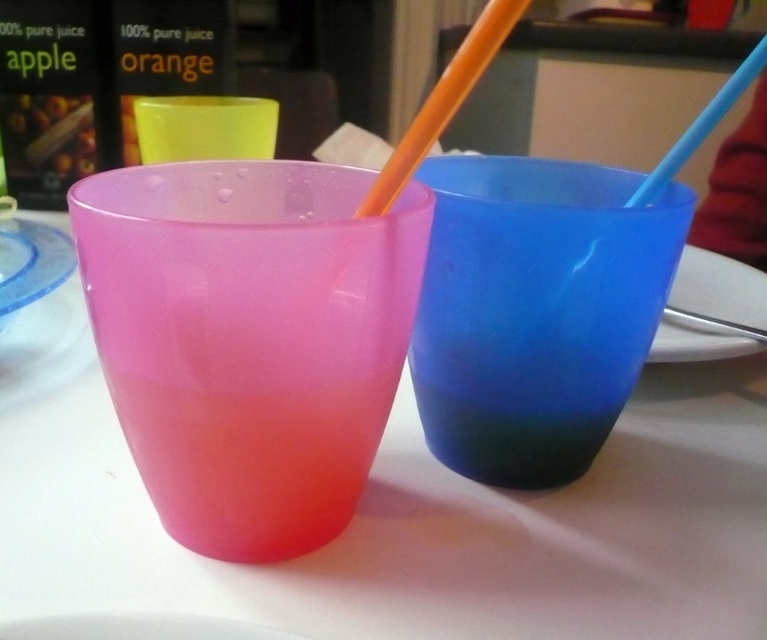
You are arranging drinks on a table and need to know the position of the cups. Which cup is placed higher up between the transparent plastic cups at center and the frosted pink cup at left?

The frosted pink cup at left is placed higher up than the transparent plastic cups at center because the transparent plastic cups at center is located below it.

You are arranging items on a table and need to place a small saltshaker. The transparent plastic plate at center is currently at position coordinates point 0.486, 0.928. If you want to place the saltshaker 2 cm to the left of the plate, where should you place it?

The saltshaker should be placed 2 cm to the left of the transparent plastic plate at center, which is currently located at point (710, 310).

Looking at this image, you are holding a camera and want to take a closeup photo of the transparent plastic cups at center. The camera requires the subject to be at least 12 inches away to focus properly. Based on the scene description, will the cups be in focus?

The transparent plastic cups at center are 10.32 inches away from the camera, which is less than the required 12 inches for proper focus. Therefore, the cups will not be in focus.